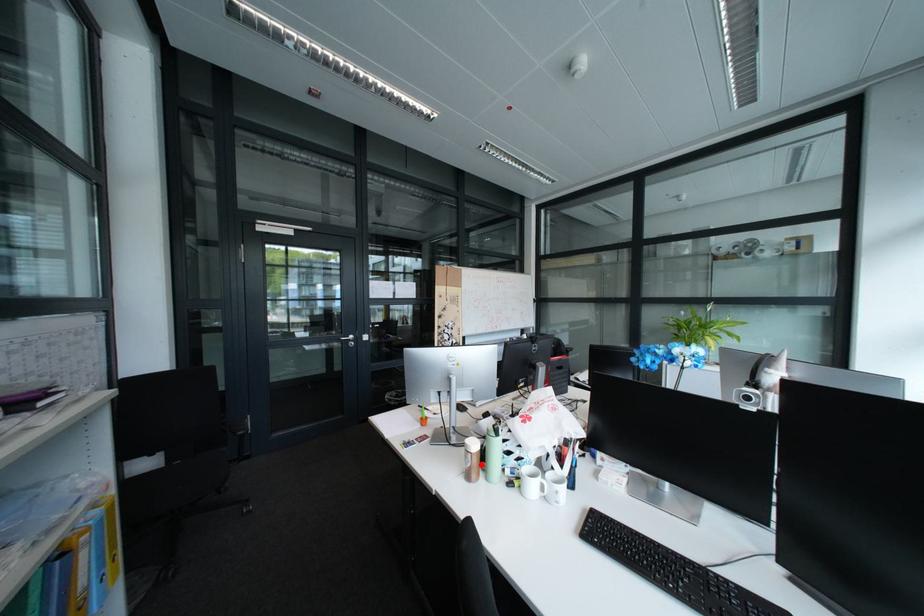
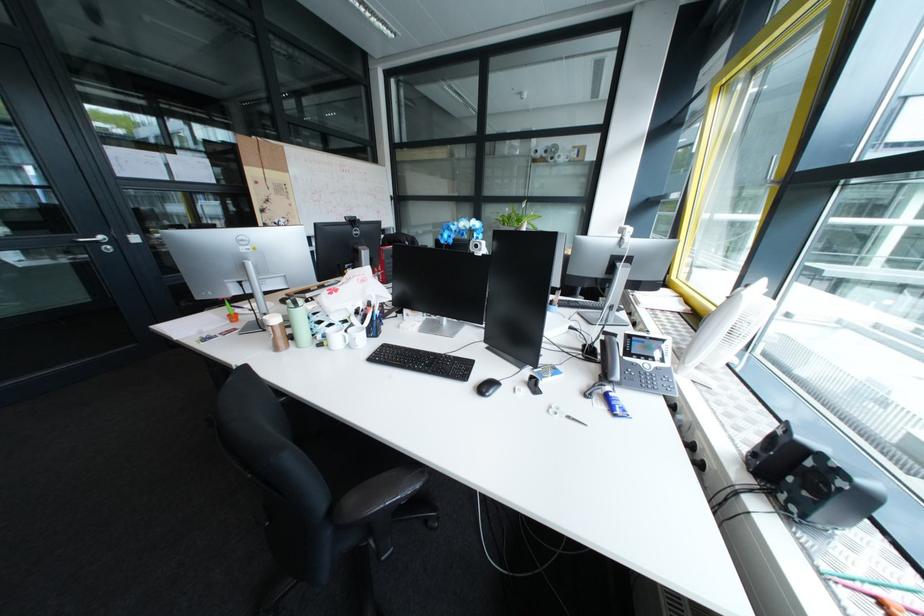
Locate, in the second image, the point that corresponds to the highlighted location in the first image.

(284, 338)